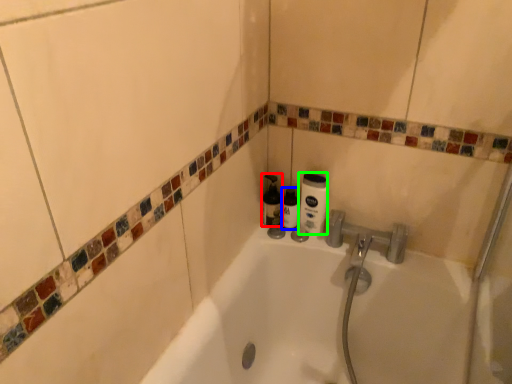
Question: Estimate the real-world distances between objects in this image. Which object is closer to bottle (highlighted by a red box), toiletry (highlighted by a blue box) or cleaning product (highlighted by a green box)?

Choices:
 (A) toiletry
 (B) cleaning product

Answer: (A)